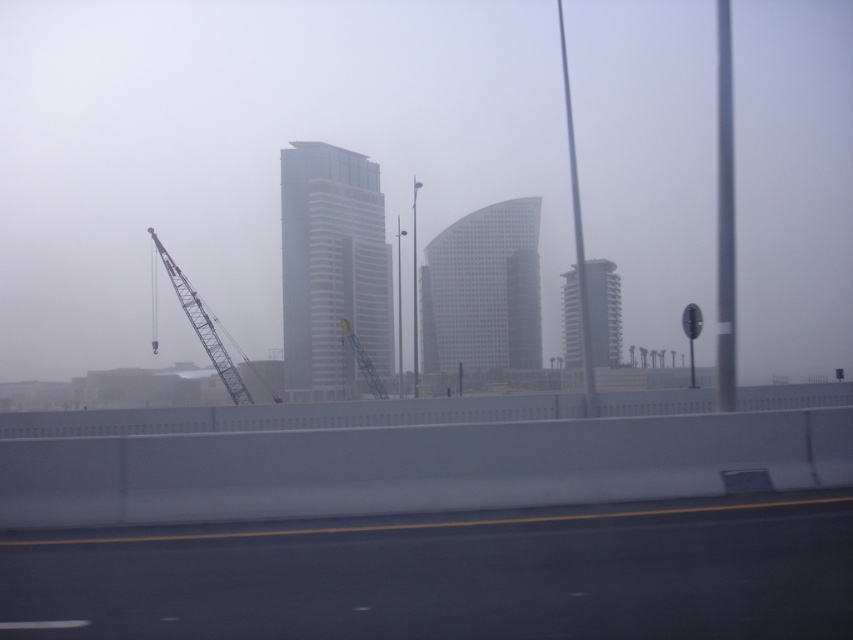
Question: Is foggy glass at center to the right of clear glass building at center from the viewer's perspective?

Choices:
 (A) yes
 (B) no

Answer: (A)

Question: Does foggy glass at center appear over black asphalt road at lower center?

Choices:
 (A) yes
 (B) no

Answer: (A)

Question: Which is farther from the smooth glass tower at center?

Choices:
 (A) black asphalt road at lower center
 (B) white glass building at center
 (C) metallic blue crane at left

Answer: (A)

Question: Is the position of black asphalt road at lower center less distant than that of smooth glass tower at center?

Choices:
 (A) yes
 (B) no

Answer: (A)

Question: Which object is the closest to the white glass building at center?

Choices:
 (A) foggy glass at center
 (B) black asphalt road at lower center
 (C) smooth glass tower at center

Answer: (A)

Question: Which object is closer to the camera taking this photo?

Choices:
 (A) foggy glass at center
 (B) black asphalt road at lower center
 (C) smooth glass tower at center

Answer: (B)